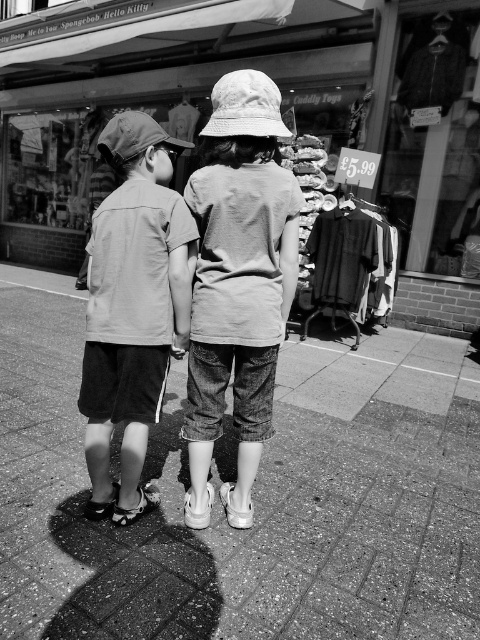
Question: Does white cotton shirt at center have a smaller size compared to white fabric sandal at lower center?

Choices:
 (A) yes
 (B) no

Answer: (B)

Question: Does textured fabric shirts at center lie in front of white cotton shirt at center?

Choices:
 (A) no
 (B) yes

Answer: (A)

Question: Can you confirm if textured fabric shirts at center is positioned above matte gray shirt at center?

Choices:
 (A) no
 (B) yes

Answer: (B)

Question: Among these points, which one is nearest to the camera?

Choices:
 (A) (201, 483)
 (B) (151, 224)

Answer: (B)

Question: Which point appears farthest from the camera in this image?

Choices:
 (A) (417, 177)
 (B) (47, 33)
 (C) (233, 512)

Answer: (B)

Question: Which point appears closest to the camera in this image?

Choices:
 (A) (468, 506)
 (B) (435, 301)

Answer: (A)